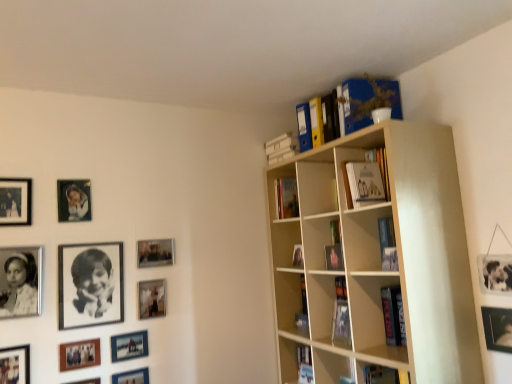
Question: Is blue cardboard file at upper right aimed at matte black picture frame at center-left, the 2th picture frame viewed from the right?

Choices:
 (A) no
 (B) yes

Answer: (A)

Question: Is blue cardboard file at upper right not within matte black picture frame at center-left, the 2th picture frame viewed from the right?

Choices:
 (A) yes
 (B) no

Answer: (A)

Question: Can you confirm if blue cardboard file at upper right is thinner than matte black picture frame at center-left, the 2th picture frame viewed from the right?

Choices:
 (A) yes
 (B) no

Answer: (B)

Question: Are blue cardboard file at upper right and matte black picture frame at center-left, the 2th picture frame viewed from the right, making contact?

Choices:
 (A) yes
 (B) no

Answer: (B)

Question: Can you confirm if blue cardboard file at upper right is positioned to the right of matte black picture frame at center-left, the eleventh picture frame viewed from the left?

Choices:
 (A) yes
 (B) no

Answer: (A)

Question: Is blue cardboard file at upper right inside or outside of matte black picture frame at upper left, the twelfth picture frame when ordered from right to left?

Choices:
 (A) outside
 (B) inside

Answer: (A)

Question: Based on their positions, is blue cardboard file at upper right located to the left or right of matte black picture frame at upper left, marked as the 1th picture frame in a left-to-right arrangement?

Choices:
 (A) left
 (B) right

Answer: (B)

Question: From the image's perspective, is blue cardboard file at upper right above or below matte black picture frame at upper left, marked as the 1th picture frame in a left-to-right arrangement?

Choices:
 (A) above
 (B) below

Answer: (A)

Question: Looking at the image, does blue cardboard file at upper right seem bigger or smaller compared to matte black picture frame at upper left, marked as the 1th picture frame in a left-to-right arrangement?

Choices:
 (A) small
 (B) big

Answer: (B)

Question: Choose the correct answer: Is matte black picture frame at lower left, which is the 7th picture frame in right-to-left order, inside black matte photo frame at lower left, which is the 11th picture frame from right to left, or outside it?

Choices:
 (A) outside
 (B) inside

Answer: (A)

Question: Relative to black matte photo frame at lower left, which ranks as the second picture frame in left-to-right order, is matte black picture frame at lower left, which is the 7th picture frame in right-to-left order, in front or behind?

Choices:
 (A) behind
 (B) front

Answer: (A)

Question: In terms of width, does matte black picture frame at lower left, which is the 7th picture frame in right-to-left order, look wider or thinner when compared to black matte photo frame at lower left, which is the 11th picture frame from right to left?

Choices:
 (A) wide
 (B) thin

Answer: (B)

Question: From a real-world perspective, relative to black matte photo frame at lower left, which is the 11th picture frame from right to left, is matte black picture frame at lower left, which is the 7th picture frame in right-to-left order, vertically above or below?

Choices:
 (A) above
 (B) below

Answer: (B)

Question: From their relative heights in the image, would you say matte black photo frame at upper left, which appears as the fourth picture frame when viewed from the left, is taller or shorter than black paper at upper left, the 6th picture frame from the right?

Choices:
 (A) short
 (B) tall

Answer: (A)

Question: Considering the relative positions of matte black photo frame at upper left, which appears as the fourth picture frame when viewed from the left, and black paper at upper left, the 6th picture frame from the right, in the image provided, is matte black photo frame at upper left, which appears as the fourth picture frame when viewed from the left, to the left or to the right of black paper at upper left, the 6th picture frame from the right,?

Choices:
 (A) left
 (B) right

Answer: (A)